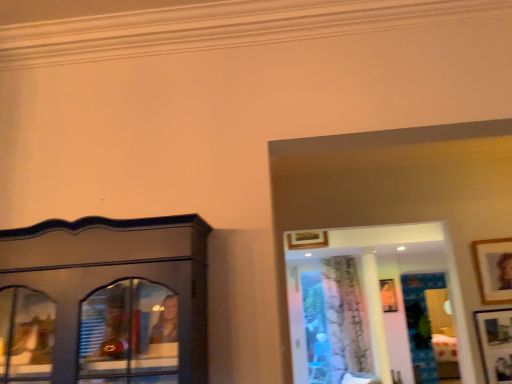
The width and height of the screenshot is (512, 384). What do you see at coordinates (307, 240) in the screenshot?
I see `wooden picture frame at upper center, which is counted as the fourth picture frame, starting from the right` at bounding box center [307, 240].

Describe the element at coordinates (388, 295) in the screenshot. This screenshot has height=384, width=512. I see `matte wooden picture frame at center, which is counted as the 4th picture frame, starting from the left` at that location.

The width and height of the screenshot is (512, 384). What do you see at coordinates (493, 269) in the screenshot? I see `wooden picture frame at upper right, positioned as the 3th picture frame in left-to-right order` at bounding box center [493, 269].

Describe the element at coordinates (495, 343) in the screenshot. I see `wooden picture frame at lower right, the 3th picture frame viewed from the right` at that location.

Locate an element on the screen. This screenshot has width=512, height=384. wooden picture frame at lower right, placed as the second picture frame when sorted from bottom to top is located at coordinates (495, 343).

This screenshot has height=384, width=512. I want to click on wooden picture frame at upper center, which is counted as the fourth picture frame, starting from the right, so point(307,240).

How different are the orientations of wooden picture frame at lower right, the 3th picture frame viewed from the right, and wooden picture frame at upper right, which is the 3th picture frame from back to front, in degrees?

They differ by 2.6 degrees in their facing directions.

Between wooden picture frame at lower right, placed as the second picture frame when sorted from left to right, and wooden picture frame at upper right, marked as the first picture frame in a top-to-bottom arrangement, which one has larger width?

With larger width is wooden picture frame at upper right, marked as the first picture frame in a top-to-bottom arrangement.

Between wooden picture frame at lower right, arranged as the fourth picture frame when viewed from the back, and wooden picture frame at upper right, arranged as the second picture frame when viewed from the front, which one has more height?

wooden picture frame at lower right, arranged as the fourth picture frame when viewed from the back, is taller.

Which point is more forward, (495, 330) or (490, 298)?

The point (495, 330) is closer.

Consider the image. Is white sheer curtain at center aimed at wooden picture frame at upper center, the first picture frame when ordered from left to right?

Yes, white sheer curtain at center is facing wooden picture frame at upper center, the first picture frame when ordered from left to right.

Does point (362, 344) lie behind point (309, 231)?

That is True.

From the image's perspective, is white sheer curtain at center located above or below wooden picture frame at upper center, which appears as the second picture frame when viewed from the top?

white sheer curtain at center is situated lower than wooden picture frame at upper center, which appears as the second picture frame when viewed from the top, in the image.

Is wooden picture frame at upper center, which ranks as the third picture frame in bottom-to-top order, to the left of white sheer curtain at center from the viewer's perspective?

Yes.

Is point (300, 239) positioned before point (339, 341)?

Yes, point (300, 239) is in front of point (339, 341).

Consider the image. Considering the sizes of objects wooden picture frame at upper center, which appears as the second picture frame when viewed from the top, and white sheer curtain at center in the image provided, who is taller, wooden picture frame at upper center, which appears as the second picture frame when viewed from the top, or white sheer curtain at center?

Standing taller between the two is white sheer curtain at center.

How many degrees apart are the facing directions of wooden picture frame at upper center, the first picture frame when ordered from left to right, and white sheer curtain at center?

The angle between the facing direction of wooden picture frame at upper center, the first picture frame when ordered from left to right, and the facing direction of white sheer curtain at center is 6.33 degrees.

How many degrees apart are the facing directions of white sheer curtain at center and wooden picture frame at lower right, placed as the second picture frame when sorted from left to right?

6.67 degrees.

Is wooden picture frame at lower right, which ranks as the third picture frame in top-to-bottom order, inside white sheer curtain at center?

No, wooden picture frame at lower right, which ranks as the third picture frame in top-to-bottom order, is not a part of white sheer curtain at center.

Considering the sizes of objects white sheer curtain at center and wooden picture frame at lower right, the 3th picture frame viewed from the right, in the image provided, who is bigger, white sheer curtain at center or wooden picture frame at lower right, the 3th picture frame viewed from the right,?

Bigger between the two is white sheer curtain at center.

From the image's perspective, who appears lower, white sheer curtain at center or wooden picture frame at lower right, placed as the first picture frame when sorted from front to back?

white sheer curtain at center.

Is the position of white sheer curtain at center less distant than that of matte wooden picture frame at center, the 4th picture frame in the front-to-back sequence?

Yes, it is in front of matte wooden picture frame at center, the 4th picture frame in the front-to-back sequence.

Measure the distance between white sheer curtain at center and matte wooden picture frame at center, the 4th picture frame in the front-to-back sequence.

21.06 inches.

In terms of height, does white sheer curtain at center look taller or shorter compared to matte wooden picture frame at center, which is counted as the 4th picture frame, starting from the left?

Clearly, white sheer curtain at center is taller compared to matte wooden picture frame at center, which is counted as the 4th picture frame, starting from the left.

Does wooden picture frame at upper center, which appears as the second picture frame when viewed from the top, contain wooden picture frame at lower right, placed as the first picture frame when sorted from front to back?

No, wooden picture frame at upper center, which appears as the second picture frame when viewed from the top, does not contain wooden picture frame at lower right, placed as the first picture frame when sorted from front to back.

Is wooden picture frame at upper center, which is counted as the fourth picture frame, starting from the right, facing towards wooden picture frame at lower right, placed as the second picture frame when sorted from left to right?

No, wooden picture frame at upper center, which is counted as the fourth picture frame, starting from the right, is not facing towards wooden picture frame at lower right, placed as the second picture frame when sorted from left to right.

From the image's perspective, which one is positioned lower, wooden picture frame at upper center, the first picture frame when ordered from left to right, or wooden picture frame at lower right, placed as the second picture frame when sorted from bottom to top?

wooden picture frame at lower right, placed as the second picture frame when sorted from bottom to top, is shown below in the image.

Does point (324, 246) come in front of point (481, 316)?

No.

From a real-world perspective, which is physically above, wooden picture frame at lower right, arranged as the fourth picture frame when viewed from the back, or matte wooden picture frame at center, arranged as the fourth picture frame when viewed from the top?

matte wooden picture frame at center, arranged as the fourth picture frame when viewed from the top.

Considering the sizes of wooden picture frame at lower right, placed as the second picture frame when sorted from bottom to top, and matte wooden picture frame at center, the first picture frame positioned from the right, in the image, is wooden picture frame at lower right, placed as the second picture frame when sorted from bottom to top, wider or thinner than matte wooden picture frame at center, the first picture frame positioned from the right,?

wooden picture frame at lower right, placed as the second picture frame when sorted from bottom to top, is thinner than matte wooden picture frame at center, the first picture frame positioned from the right.

Is wooden picture frame at lower right, arranged as the fourth picture frame when viewed from the back, in front of or behind matte wooden picture frame at center, acting as the first picture frame starting from the bottom, in the image?

wooden picture frame at lower right, arranged as the fourth picture frame when viewed from the back, is in front of matte wooden picture frame at center, acting as the first picture frame starting from the bottom.

Which is behind, point (488, 329) or point (385, 302)?

The point (385, 302) is behind.

Which picture frame is the 1st one when counting from the left side of the wooden picture frame at upper right, the 2th picture frame when ordered from right to left? Please provide its 2D coordinates.

[(495, 343)]

From the image's perspective, count 3rd picture frames upward from the white sheer curtain at center and point to it. Please provide its 2D coordinates.

[(307, 240)]

Based on their spatial positions, is wooden picture frame at lower right, arranged as the fourth picture frame when viewed from the back, or wooden picture frame at upper right, which is the 3th picture frame from back to front, further from white sheer curtain at center?

wooden picture frame at upper right, which is the 3th picture frame from back to front, is positioned further to the anchor white sheer curtain at center.

Considering their positions, is white sheer curtain at center positioned closer to matte wooden picture frame at center, arranged as the fourth picture frame when viewed from the top, than wooden picture frame at lower right, placed as the second picture frame when sorted from left to right?

white sheer curtain at center is closer to matte wooden picture frame at center, arranged as the fourth picture frame when viewed from the top.

Based on their spatial positions, is wooden picture frame at upper right, marked as the first picture frame in a top-to-bottom arrangement, or matte wooden picture frame at center, the 4th picture frame in the front-to-back sequence, closer to wooden picture frame at lower right, which ranks as the third picture frame in top-to-bottom order?

wooden picture frame at upper right, marked as the first picture frame in a top-to-bottom arrangement, is closer to wooden picture frame at lower right, which ranks as the third picture frame in top-to-bottom order.

Based on their spatial positions, is wooden picture frame at lower right, which ranks as the third picture frame in top-to-bottom order, or wooden picture frame at upper right, positioned as the 3th picture frame in left-to-right order, further from wooden picture frame at upper center, which appears as the 2th picture frame when viewed from the back?

The object further to wooden picture frame at upper center, which appears as the 2th picture frame when viewed from the back, is wooden picture frame at lower right, which ranks as the third picture frame in top-to-bottom order.

Looking at the image, which one is located closer to matte wooden picture frame at center, the 4th picture frame in the front-to-back sequence, white sheer curtain at center or wooden picture frame at upper right, the 2th picture frame when ordered from right to left?

white sheer curtain at center is closer to matte wooden picture frame at center, the 4th picture frame in the front-to-back sequence.

Based on their spatial positions, is wooden picture frame at upper center, which appears as the 2th picture frame when viewed from the back, or matte wooden picture frame at center, which appears as the first picture frame when viewed from the back, closer to wooden picture frame at upper right, the 2th picture frame when ordered from right to left?

Based on the image, wooden picture frame at upper center, which appears as the 2th picture frame when viewed from the back, appears to be nearer to wooden picture frame at upper right, the 2th picture frame when ordered from right to left.

Which object lies further to the anchor point wooden picture frame at upper right, marked as the first picture frame in a top-to-bottom arrangement, matte wooden picture frame at center, which is counted as the 4th picture frame, starting from the left, or wooden picture frame at lower right, placed as the second picture frame when sorted from bottom to top?

The object further to wooden picture frame at upper right, marked as the first picture frame in a top-to-bottom arrangement, is matte wooden picture frame at center, which is counted as the 4th picture frame, starting from the left.

In the scene shown: Which object lies further to the anchor point wooden picture frame at upper center, which appears as the second picture frame when viewed from the top, wooden picture frame at upper right, marked as the first picture frame in a top-to-bottom arrangement, or matte wooden picture frame at center, arranged as the fourth picture frame when viewed from the top?

matte wooden picture frame at center, arranged as the fourth picture frame when viewed from the top, lies further to wooden picture frame at upper center, which appears as the second picture frame when viewed from the top, than the other object.

Image resolution: width=512 pixels, height=384 pixels. I want to click on curtain between wooden picture frame at upper center, which is counted as the fourth picture frame, starting from the right, and matte wooden picture frame at center, arranged as the fourth picture frame when viewed from the top, in the horizontal direction, so click(x=346, y=317).

You are a GUI agent. You are given a task and a screenshot of the screen. Output one action in this format:
    pyautogui.click(x=<x>, y=<y>)
    Task: Click on the curtain positioned between wooden picture frame at upper right, the 2th picture frame when ordered from right to left, and matte wooden picture frame at center, arranged as the fourth picture frame when viewed from the top, from near to far
    
    Given the screenshot: What is the action you would take?
    pyautogui.click(x=346, y=317)

In order to click on picture frame between wooden picture frame at upper right, arranged as the second picture frame when viewed from the front, and matte wooden picture frame at center, which is counted as the 4th picture frame, starting from the left, in the front-back direction in this screenshot , I will do `click(307, 240)`.

You are a GUI agent. You are given a task and a screenshot of the screen. Output one action in this format:
    pyautogui.click(x=<x>, y=<y>)
    Task: Click on the picture frame positioned between wooden picture frame at upper right, which is the 3th picture frame from back to front, and white sheer curtain at center from near to far
    The height and width of the screenshot is (384, 512).
    Given the screenshot: What is the action you would take?
    pyautogui.click(x=307, y=240)